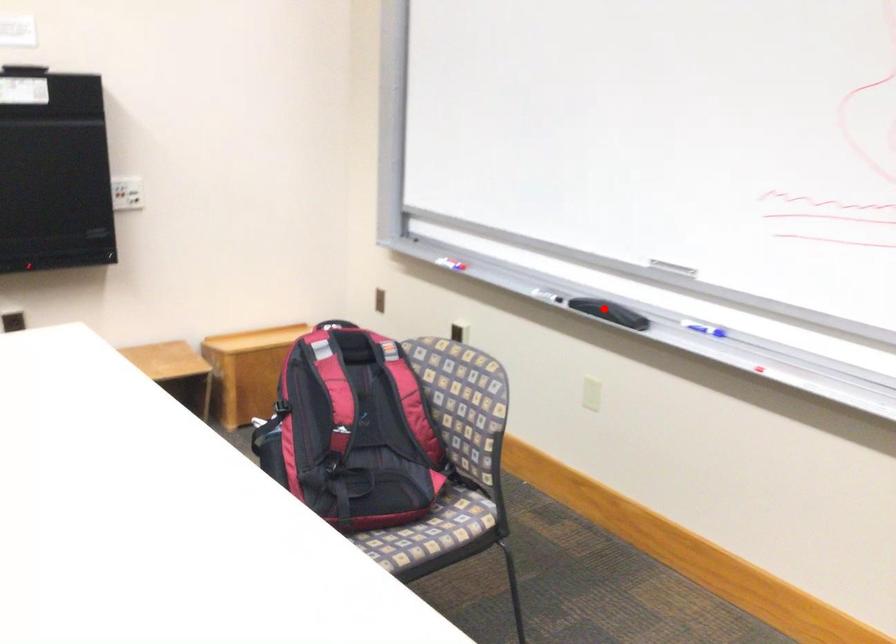
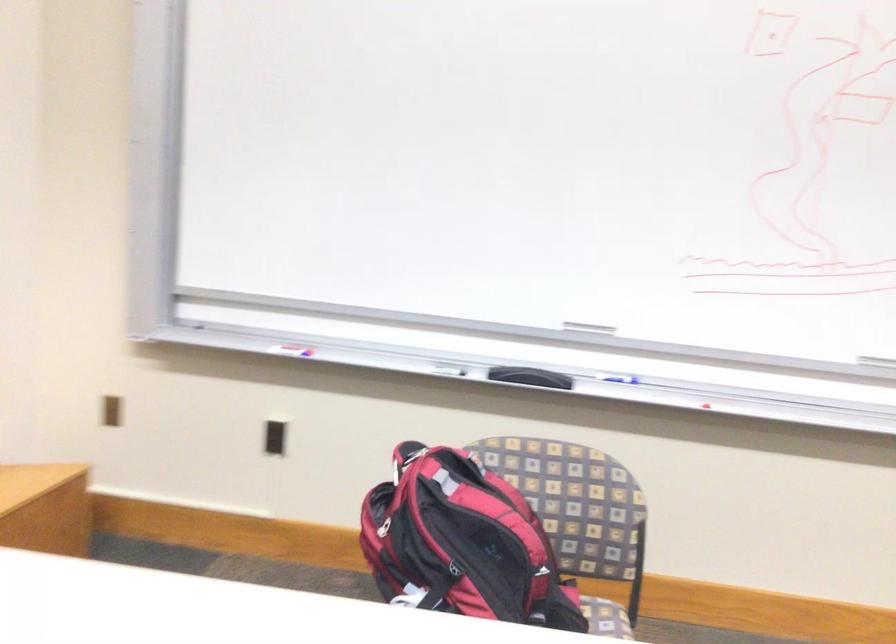
Find the pixel in the second image that matches the highlighted location in the first image.

(530, 377)